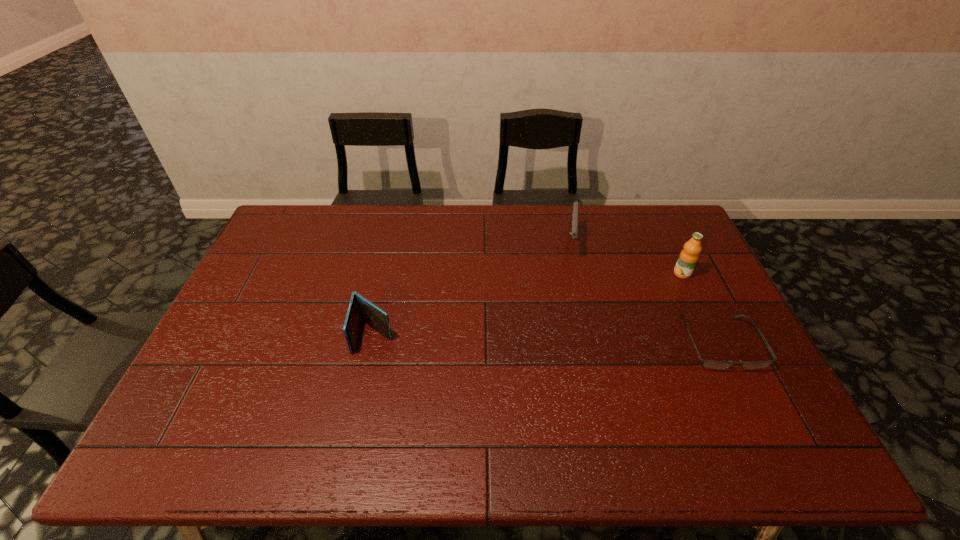
Locate an element on the screen. vacant space at the right edge of the desktop is located at coordinates (757, 360).

Locate an element on the screen. free space at the far left corner of the desktop is located at coordinates (295, 219).

Locate an element on the screen. vacant space at the near left corner of the desktop is located at coordinates (241, 390).

Image resolution: width=960 pixels, height=540 pixels. Find the location of `free space between the pistol and the tallest object`. free space between the pistol and the tallest object is located at coordinates (626, 258).

You are a GUI agent. You are given a task and a screenshot of the screen. Output one action in this format:
    pyautogui.click(x=<x>, y=<y>)
    Task: Click on the vacant area that lies between the tallest object and the leftmost object
    
    Given the screenshot: What is the action you would take?
    pyautogui.click(x=528, y=305)

Where is `empty space between the spectacles and the orange juice`? The image size is (960, 540). empty space between the spectacles and the orange juice is located at coordinates click(701, 308).

This screenshot has height=540, width=960. Find the location of `blank region between the wallet and the shortest object`. blank region between the wallet and the shortest object is located at coordinates (547, 339).

Find the location of a particular element. Image resolution: width=960 pixels, height=540 pixels. unoccupied position between the wallet and the orange juice is located at coordinates [528, 305].

Where is `empty space that is in between the third nearest object and the spectacles`? empty space that is in between the third nearest object and the spectacles is located at coordinates (701, 308).

Where is `empty space between the tallest object and the pistol`? empty space between the tallest object and the pistol is located at coordinates (626, 258).